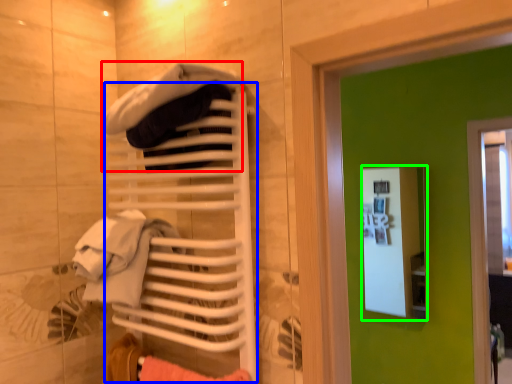
Question: Which is farther away from clothing (highlighted by a red box)? closet (highlighted by a blue box) or medicine cabinet (highlighted by a green box)?

Choices:
 (A) closet
 (B) medicine cabinet

Answer: (B)